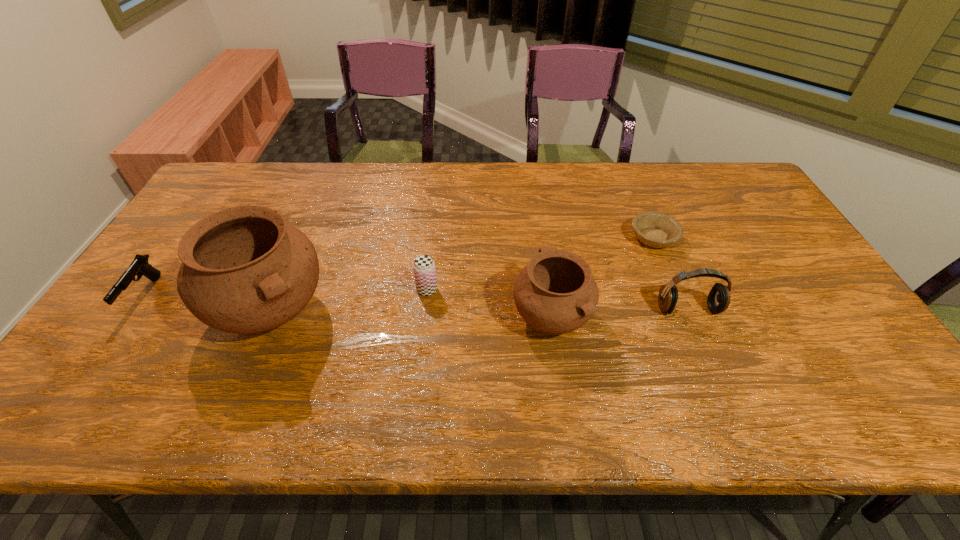
In order to click on the fourth closest object to the headset in this screenshot , I will do `click(244, 270)`.

The image size is (960, 540). What are the coordinates of `object that is the fifth closest one to the beer can` in the screenshot? It's located at (139, 266).

The image size is (960, 540). I want to click on free space that satisfies the following two spatial constraints: 1. on the front side of the shorter pottery; 2. on the left side of the beer can, so click(x=424, y=316).